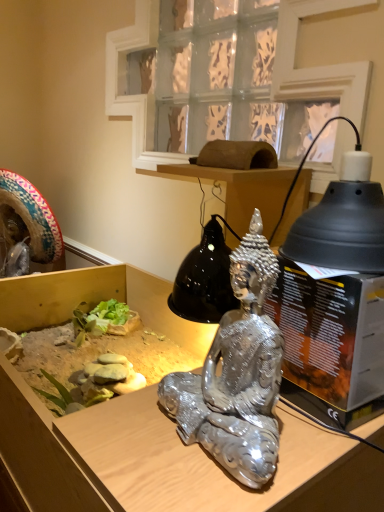
Question: Is clear glass window at upper center oriented towards metallic statue at center?

Choices:
 (A) no
 (B) yes

Answer: (A)

Question: Is clear glass window at upper center at the left side of metallic statue at center?

Choices:
 (A) yes
 (B) no

Answer: (B)

Question: From a real-world perspective, does clear glass window at upper center sit lower than metallic statue at center?

Choices:
 (A) yes
 (B) no

Answer: (B)

Question: Is metallic statue at center at the back of clear glass window at upper center?

Choices:
 (A) no
 (B) yes

Answer: (A)

Question: Is clear glass window at upper center surrounding metallic statue at center?

Choices:
 (A) yes
 (B) no

Answer: (B)

Question: Is shiny silver statue at center in front of or behind metallic statue at center in the image?

Choices:
 (A) behind
 (B) front

Answer: (A)

Question: From a real-world perspective, relative to metallic statue at center, is shiny silver statue at center vertically above or below?

Choices:
 (A) below
 (B) above

Answer: (B)

Question: In terms of width, does shiny silver statue at center look wider or thinner when compared to metallic statue at center?

Choices:
 (A) wide
 (B) thin

Answer: (B)

Question: From the image's perspective, is shiny silver statue at center located above or below metallic statue at center?

Choices:
 (A) below
 (B) above

Answer: (B)

Question: From the image's perspective, is shiny silver statue at center positioned above or below black matte lampshade at upper right?

Choices:
 (A) below
 (B) above

Answer: (A)

Question: Is shiny silver statue at center inside or outside of black matte lampshade at upper right?

Choices:
 (A) outside
 (B) inside

Answer: (A)

Question: From a real-world perspective, relative to black matte lampshade at upper right, is shiny silver statue at center vertically above or below?

Choices:
 (A) above
 (B) below

Answer: (B)

Question: Considering the positions of shiny silver statue at center and black matte lampshade at upper right in the image, is shiny silver statue at center taller or shorter than black matte lampshade at upper right?

Choices:
 (A) short
 (B) tall

Answer: (B)

Question: Considering the positions of point (364, 229) and point (165, 409), is point (364, 229) closer or farther from the camera than point (165, 409)?

Choices:
 (A) farther
 (B) closer

Answer: (B)

Question: Looking at the image, does black matte lampshade at upper right seem bigger or smaller compared to shiny silver statue at center?

Choices:
 (A) small
 (B) big

Answer: (A)